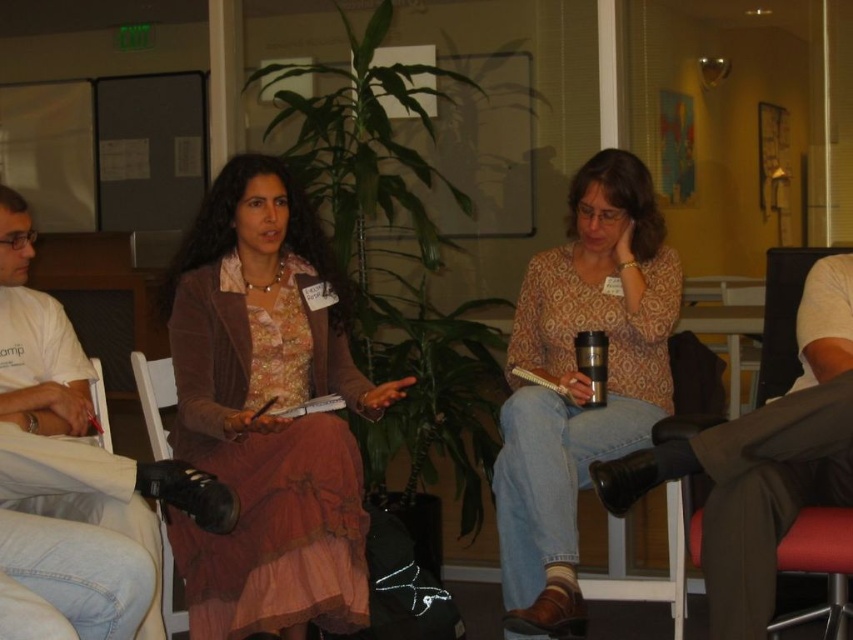
Between patterned fabric blouse at center and brown leather chair at lower right, which one has less height?

With less height is brown leather chair at lower right.

Is patterned fabric blouse at center further to the viewer compared to brown leather chair at lower right?

Yes, patterned fabric blouse at center is further from the viewer.

Is point (523, 604) behind point (813, 406)?

Yes, it is behind point (813, 406).

I want to click on patterned fabric blouse at center, so click(x=579, y=381).

Is matte pink dress at center bigger than patterned fabric blouse at center?

Actually, matte pink dress at center might be smaller than patterned fabric blouse at center.

Is matte pink dress at center further to the viewer compared to patterned fabric blouse at center?

That is False.

The width and height of the screenshot is (853, 640). Describe the element at coordinates (265, 413) in the screenshot. I see `matte pink dress at center` at that location.

At what (x,y) coordinates should I click in order to perform the action: click on matte pink dress at center. Please return your answer as a coordinate pair (x, y). Looking at the image, I should click on (265, 413).

Between matte pink dress at center and silver metallic cup at center, which one appears on the left side from the viewer's perspective?

From the viewer's perspective, matte pink dress at center appears more on the left side.

Can you confirm if matte pink dress at center is positioned below silver metallic cup at center?

Yes, matte pink dress at center is below silver metallic cup at center.

Which is behind, point (271, 435) or point (582, 358)?

Point (582, 358)

Locate an element on the screen. matte pink dress at center is located at coordinates (265, 413).